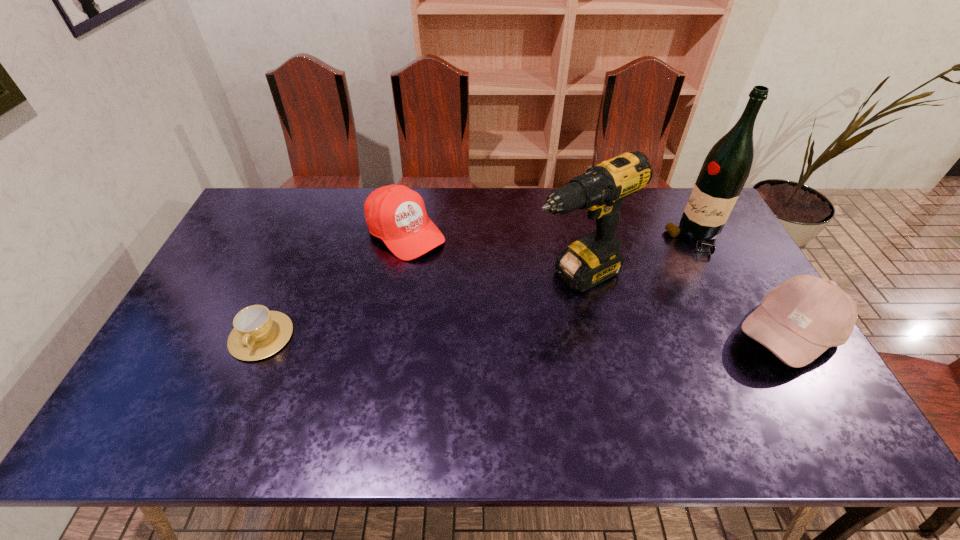
This screenshot has width=960, height=540. What are the coordinates of `free space located 0.370m at the tip of the drill` in the screenshot? It's located at (429, 350).

Where is `vacant space situated 0.100m on the surface of the wine bottle`? This screenshot has width=960, height=540. vacant space situated 0.100m on the surface of the wine bottle is located at coordinates (663, 266).

Find the location of a particular element. vacant space located 0.380m on the surface of the wine bottle is located at coordinates (609, 313).

Where is `free space located on the surface of the wine bottle`? free space located on the surface of the wine bottle is located at coordinates (632, 293).

At what (x,y) coordinates should I click in order to perform the action: click on free location located on the front panel of the left baseball cap. Please return your answer as a coordinate pair (x, y). Looking at the image, I should click on (496, 314).

Locate an element on the screen. This screenshot has height=540, width=960. vacant space situated on the front panel of the left baseball cap is located at coordinates (516, 331).

Image resolution: width=960 pixels, height=540 pixels. In order to click on free spot located on the front panel of the left baseball cap in this screenshot , I will do `click(487, 306)`.

Find the location of a particular element. This screenshot has width=960, height=540. wine bottle that is at the far edge is located at coordinates (726, 168).

At what (x,y) coordinates should I click in order to perform the action: click on baseball cap that is at the far edge. Please return your answer as a coordinate pair (x, y). Looking at the image, I should click on (396, 214).

The height and width of the screenshot is (540, 960). I want to click on object at the near edge, so click(800, 319).